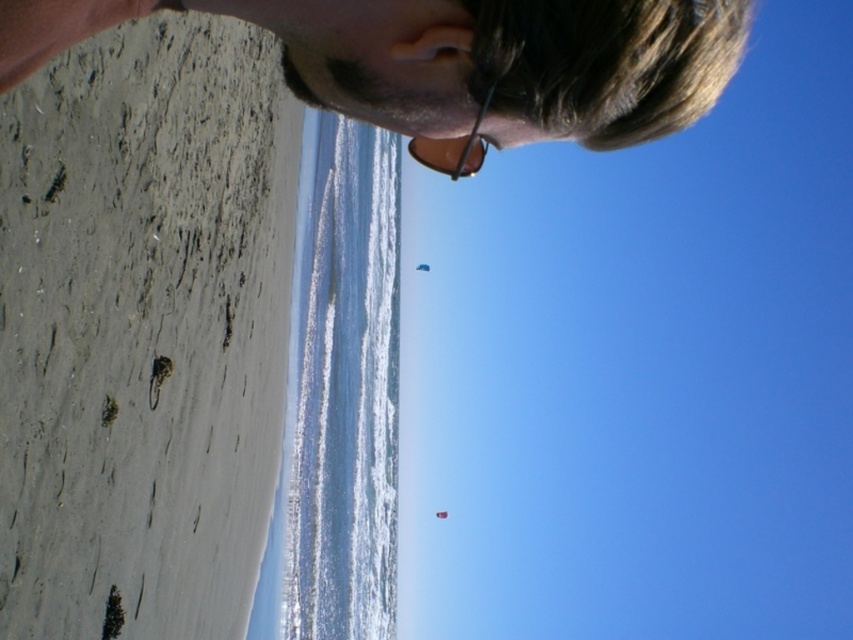
Question: Where is smooth sand at lower left located in relation to sunglasses at upper center in the image?

Choices:
 (A) below
 (B) above

Answer: (A)

Question: Estimate the real-world distances between objects in this image. Which object is closer to the red fabric kite at upper center?

Choices:
 (A) sunglasses at upper center
 (B) matte black hair at upper center

Answer: (B)

Question: Which of these objects is positioned farthest from the sunglasses at upper center?

Choices:
 (A) red fabric kite at upper center
 (B) smooth sand at lower left
 (C) matte black hair at upper center

Answer: (A)

Question: Does matte black hair at upper center appear over blue fabric kite at center?

Choices:
 (A) no
 (B) yes

Answer: (A)

Question: Is smooth sand at lower left to the right of sunglasses at upper center from the viewer's perspective?

Choices:
 (A) no
 (B) yes

Answer: (A)

Question: Which point is farther to the camera?

Choices:
 (A) red fabric kite at upper center
 (B) sunglasses at upper center
 (C) blue fabric kite at center
 (D) smooth sand at lower left

Answer: (C)